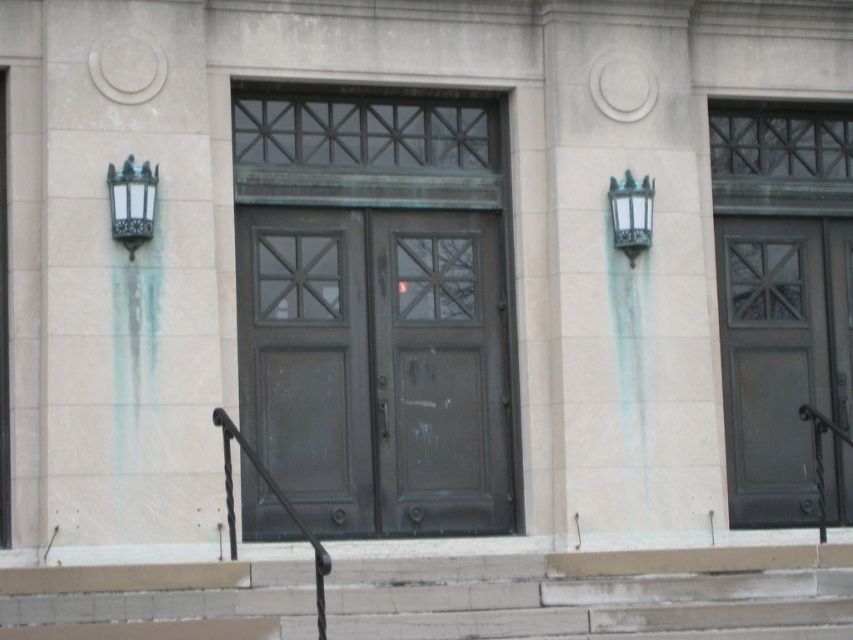
You are standing at the entrance of the building and want to locate the matte dark brown door at right. Where should you look relative to the green patina lamp at upper right?

The matte dark brown door at right is located below the green patina lamp at upper right.

You are a delivery person trying to enter the building through the matte dark brown door at right. However, you notice a green patina lamp at upper right above the door. Can you fit a 2.2m tall package through the door without touching the lamp?

The matte dark brown door at right is taller than the green patina lamp at upper right. Since the door is taller, the 2.2m tall package can fit through the door without touching the lamp.

You are standing at the entrance of the building and want to place a decorative item between the two points labeled point [491,454] and point [827,246]. Which point should the item be placed closer to in order to be closer to the viewer?

The decorative item should be placed closer to point [491,454] because it is closer to the viewer than point [827,246].